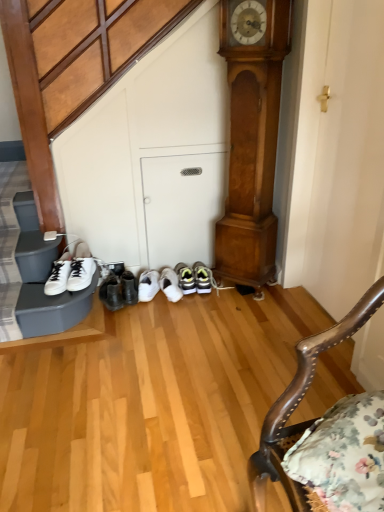
Question: Is polished wood grandfather clock at center positioned beyond the bounds of wooden polished chair at lower right?

Choices:
 (A) yes
 (B) no

Answer: (A)

Question: From the image's perspective, would you say polished wood grandfather clock at center is shown under wooden polished chair at lower right?

Choices:
 (A) no
 (B) yes

Answer: (A)

Question: Can you confirm if polished wood grandfather clock at center is thinner than wooden polished chair at lower right?

Choices:
 (A) no
 (B) yes

Answer: (B)

Question: Does polished wood grandfather clock at center lie in front of wooden polished chair at lower right?

Choices:
 (A) no
 (B) yes

Answer: (A)

Question: Is polished wood grandfather clock at center turned away from wooden polished chair at lower right?

Choices:
 (A) yes
 (B) no

Answer: (B)

Question: Considering their positions, is polished wood grandfather clock at center located in front of or behind wooden polished chair at lower right?

Choices:
 (A) behind
 (B) front

Answer: (A)

Question: Is polished wood grandfather clock at center taller or shorter than wooden polished chair at lower right?

Choices:
 (A) short
 (B) tall

Answer: (B)

Question: From the image's perspective, is polished wood grandfather clock at center above or below wooden polished chair at lower right?

Choices:
 (A) above
 (B) below

Answer: (A)

Question: In the image, is polished wood grandfather clock at center on the left side or the right side of wooden polished chair at lower right?

Choices:
 (A) left
 (B) right

Answer: (A)

Question: Considering the positions of white matte sneakers at left and polished wood grandfather clock at center in the image, is white matte sneakers at left bigger or smaller than polished wood grandfather clock at center?

Choices:
 (A) big
 (B) small

Answer: (B)

Question: From a real-world perspective, relative to polished wood grandfather clock at center, is white matte sneakers at left vertically above or below?

Choices:
 (A) above
 (B) below

Answer: (B)

Question: Considering their positions, is white matte sneakers at left located in front of or behind polished wood grandfather clock at center?

Choices:
 (A) behind
 (B) front

Answer: (A)

Question: Considering the relative positions of white matte sneakers at left and polished wood grandfather clock at center in the image provided, is white matte sneakers at left to the left or to the right of polished wood grandfather clock at center?

Choices:
 (A) left
 (B) right

Answer: (A)

Question: In terms of size, does white matte sneakers at left appear bigger or smaller than wooden polished chair at lower right?

Choices:
 (A) big
 (B) small

Answer: (B)

Question: Considering the positions of point (51, 282) and point (264, 470), is point (51, 282) closer or farther from the camera than point (264, 470)?

Choices:
 (A) farther
 (B) closer

Answer: (A)